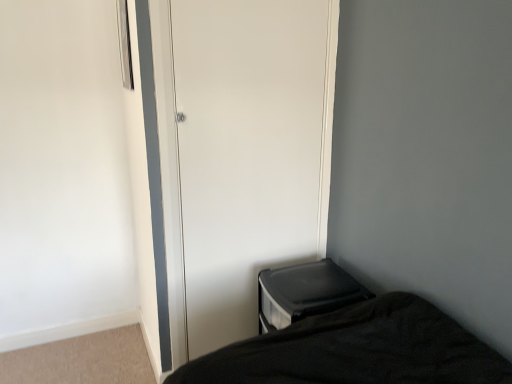
Question: From a real-world perspective, does black plastic changing table at lower right sit lower than white glossy door at center?

Choices:
 (A) yes
 (B) no

Answer: (A)

Question: From a real-world perspective, is black plastic changing table at lower right physically above white glossy door at center?

Choices:
 (A) yes
 (B) no

Answer: (B)

Question: Can white glossy door at center be found inside black plastic changing table at lower right?

Choices:
 (A) no
 (B) yes

Answer: (A)

Question: Does black plastic changing table at lower right have a greater height compared to white glossy door at center?

Choices:
 (A) no
 (B) yes

Answer: (A)

Question: Does black plastic changing table at lower right appear on the left side of white glossy door at center?

Choices:
 (A) no
 (B) yes

Answer: (A)

Question: Does black plastic changing table at lower right come behind white glossy door at center?

Choices:
 (A) no
 (B) yes

Answer: (B)

Question: Considering the relative sizes of white glossy door at center and black plastic changing table at lower right in the image provided, is white glossy door at center bigger than black plastic changing table at lower right?

Choices:
 (A) no
 (B) yes

Answer: (A)

Question: From the image's perspective, is white glossy door at center below black plastic changing table at lower right?

Choices:
 (A) yes
 (B) no

Answer: (B)

Question: Considering the relative sizes of white glossy door at center and black plastic changing table at lower right in the image provided, is white glossy door at center wider than black plastic changing table at lower right?

Choices:
 (A) yes
 (B) no

Answer: (B)

Question: Is white glossy door at center smaller than black plastic changing table at lower right?

Choices:
 (A) no
 (B) yes

Answer: (B)

Question: Could black plastic changing table at lower right be considered to be inside white glossy door at center?

Choices:
 (A) yes
 (B) no

Answer: (B)

Question: Is white glossy door at center touching black plastic changing table at lower right?

Choices:
 (A) no
 (B) yes

Answer: (A)

Question: Considering the relative positions of black plastic changing table at lower right and white glossy door at center in the image provided, is black plastic changing table at lower right to the left or to the right of white glossy door at center?

Choices:
 (A) left
 (B) right

Answer: (B)